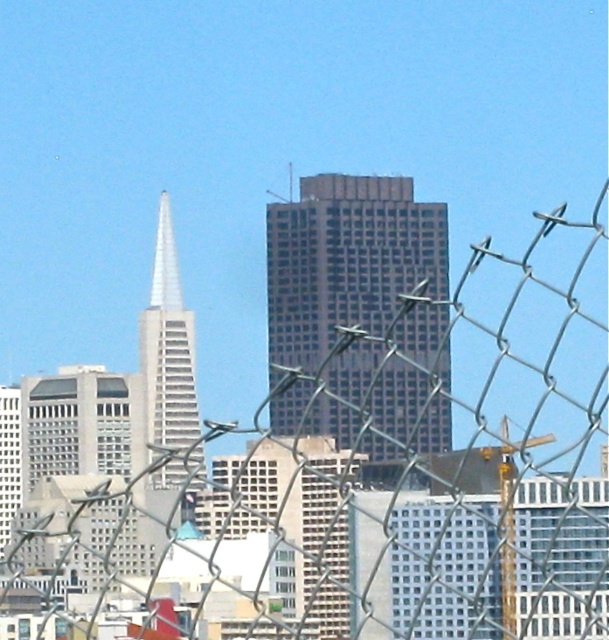
In the scene shown: You are a drone operator trying to fly your drone from the dark glass skyscraper at center to the shiny silver spire at center. According to the scene, which building should you start your drone from, and why?

The dark glass skyscraper at center is closer to the viewer than the shiny silver spire at center, so you should start the drone from the dark glass skyscraper at center to reach the shiny silver spire at center.